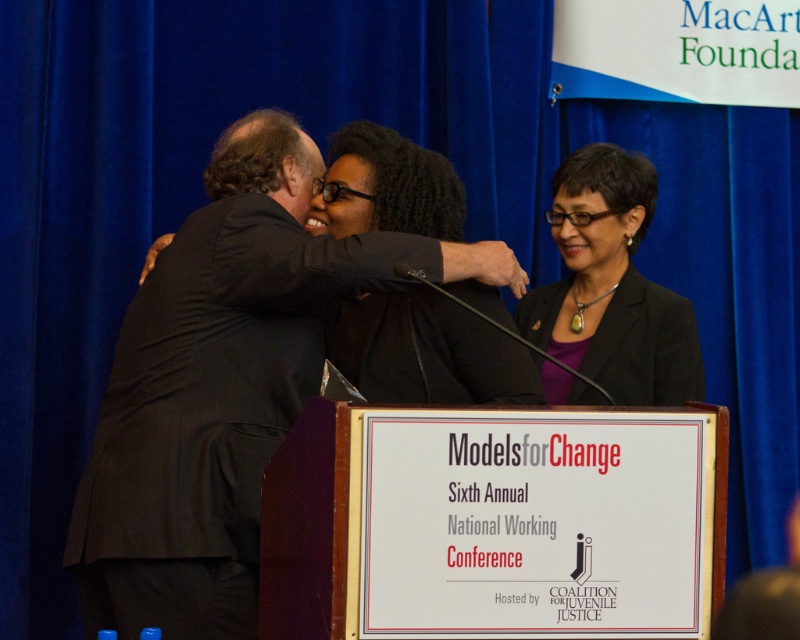
You are an event organizer and need to arrange seating based on attire. You notice a black suit at center and a matte black blazer at center. Which attire should be seated in the front row to ensure visibility?

The black suit at center is taller than the matte black blazer at center, so seating the person in the black suit at center in the front row will ensure better visibility since they are taller.

You are attending the Sixth Annual National Working Conference and notice two attendees wearing black suits. One is wearing a black suit at center and the other a matte black blazer at center. From your perspective, which one is positioned to the left?

The black suit at center is positioned to the left of the matte black blazer at center.

You are standing at the entrance of the conference room. You want to approach the podium to ask a question. Which direction should you move relative to the black suit at center?

Since the podium is located in the foreground and the black suit at center is positioned at point (224, 385), you should move forward towards the podium while maintaining your position relative to the black suit at center.